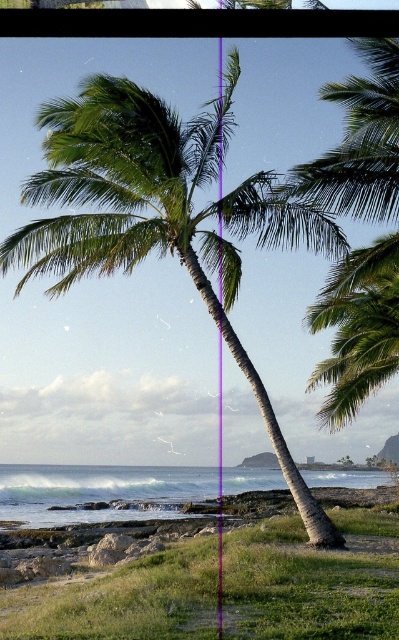
Is green leafy coconut tree at center taller than clear water at lower center?

Yes.

Does point (158, 116) come behind point (27, 493)?

That is False.

Measure the distance between point (x=102, y=230) and camera.

Point (x=102, y=230) and camera are 17.95 meters apart from each other.

In order to click on green leafy coconut tree at center in this screenshot , I will do `click(158, 218)`.